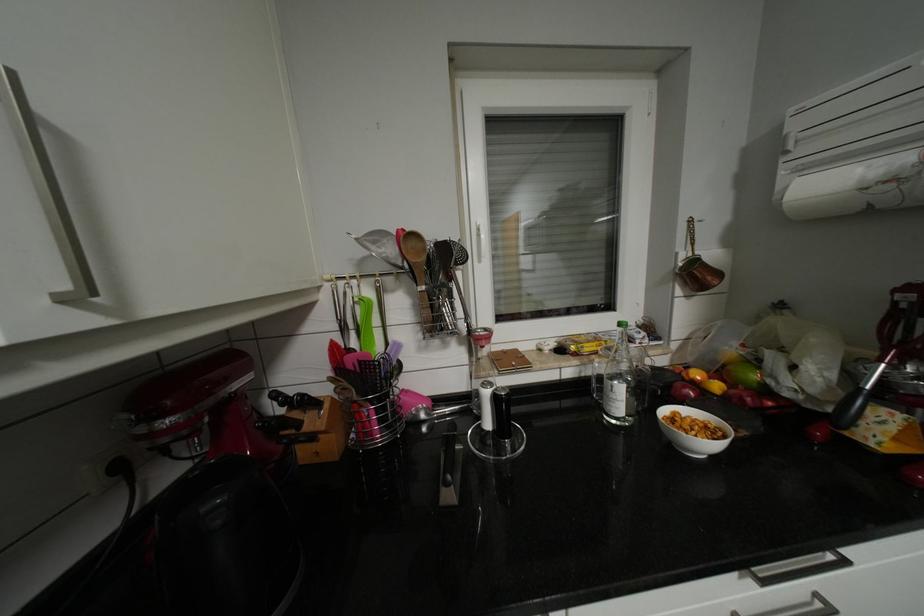
Where would you lift the black pepper shaker? Please return your answer as a coordinate pair (x, y).

(502, 413)